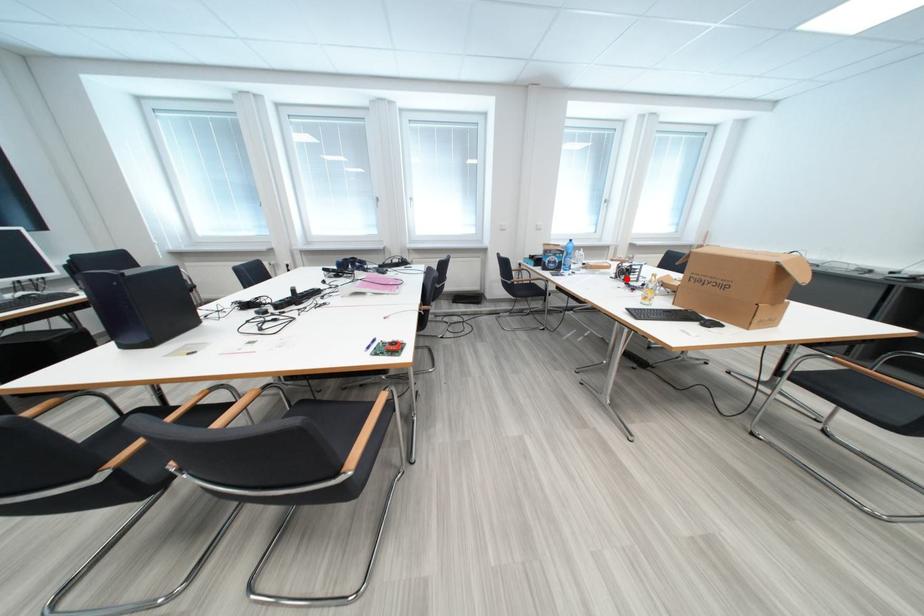
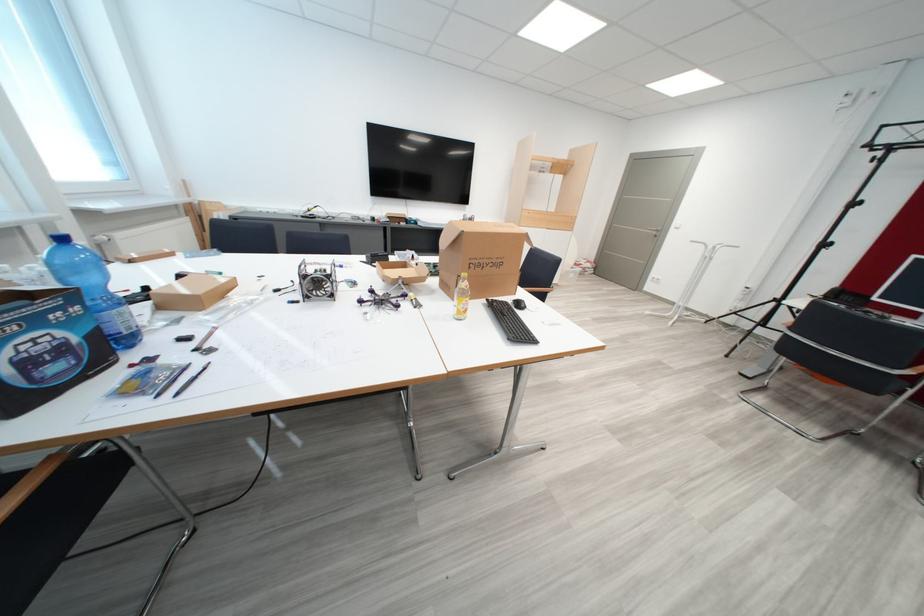
The point at the highlighted location is marked in the first image. Where is the corresponding point in the second image?

(317, 300)